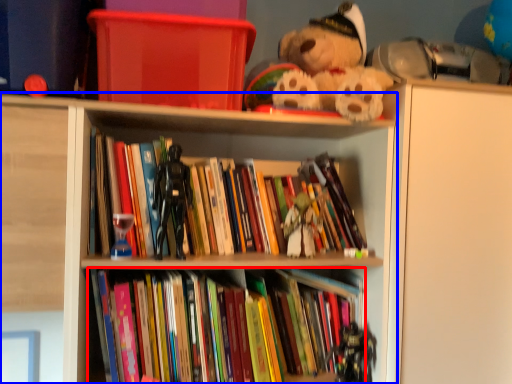
Question: Among these objects, which one is farthest to the camera, book (highlighted by a red box) or shelf (highlighted by a blue box)?

Choices:
 (A) book
 (B) shelf

Answer: (A)